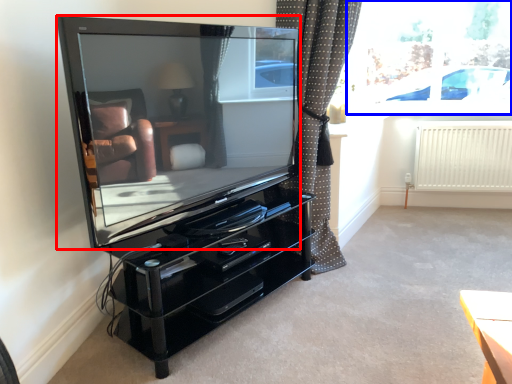
Question: Among these objects, which one is farthest to the camera, television (highlighted by a red box) or window screen (highlighted by a blue box)?

Choices:
 (A) television
 (B) window screen

Answer: (B)